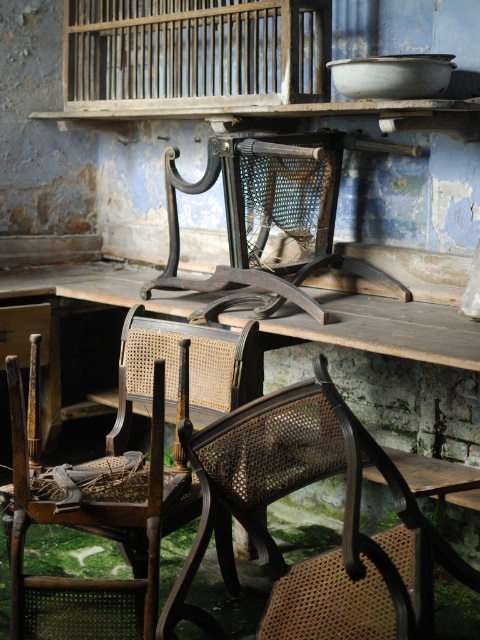
Looking at this image, is brown cane chair at center above woven cane chair at center?

Incorrect, brown cane chair at center is not positioned above woven cane chair at center.

Who is more forward, (240,410) or (38,602)?

Point (240,410) is more forward.

Image resolution: width=480 pixels, height=640 pixels. Identify the location of brown cane chair at center. (343, 524).

Between woven cane chair at center and woven wood birdcage at center, which one has less height?

woven cane chair at center

Who is positioned more to the left, woven cane chair at center or woven wood birdcage at center?

From the viewer's perspective, woven cane chair at center appears more on the left side.

Is point (36, 577) positioned before point (255, 273)?

That is True.

Identify the location of woven cane chair at center. (90, 529).

Does point (334, 556) lie behind point (151, 12)?

No.

Which is in front, point (299, 589) or point (68, 76)?

Point (299, 589) is in front.

Which is in front, point (267, 618) or point (87, 45)?

Point (267, 618)

Where is `brown cane chair at center`? This screenshot has width=480, height=640. brown cane chair at center is located at coordinates click(x=343, y=524).